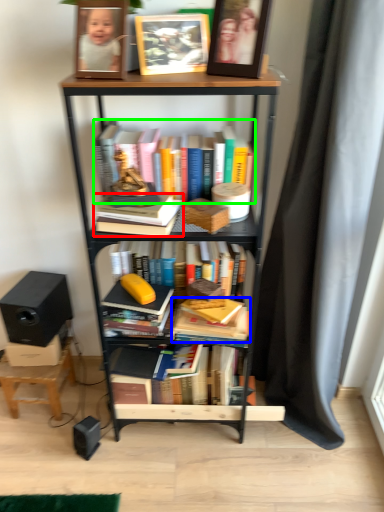
Question: Which object is the farthest from book (highlighted by a red box)? Choose among these: book (highlighted by a blue box) or book (highlighted by a green box).

Choices:
 (A) book
 (B) book

Answer: (A)